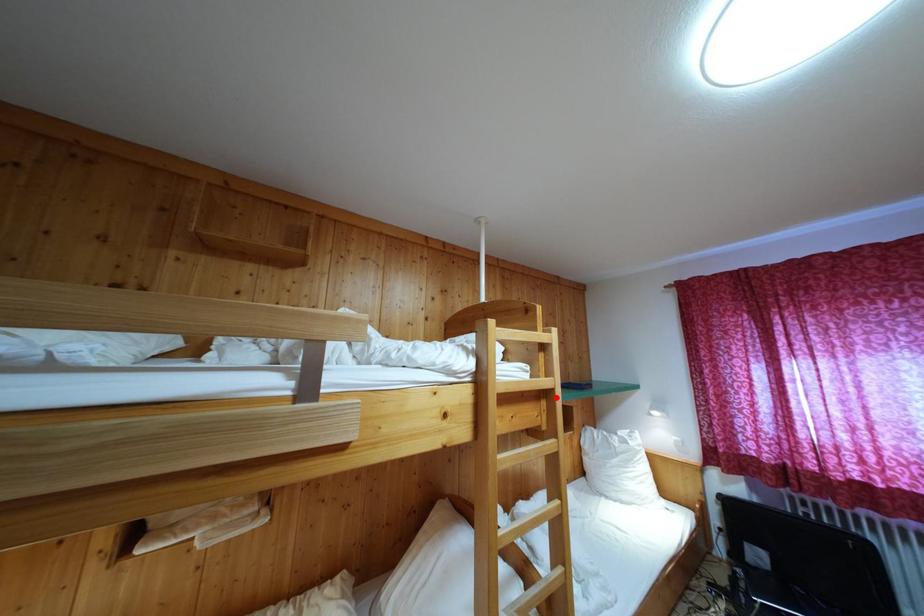
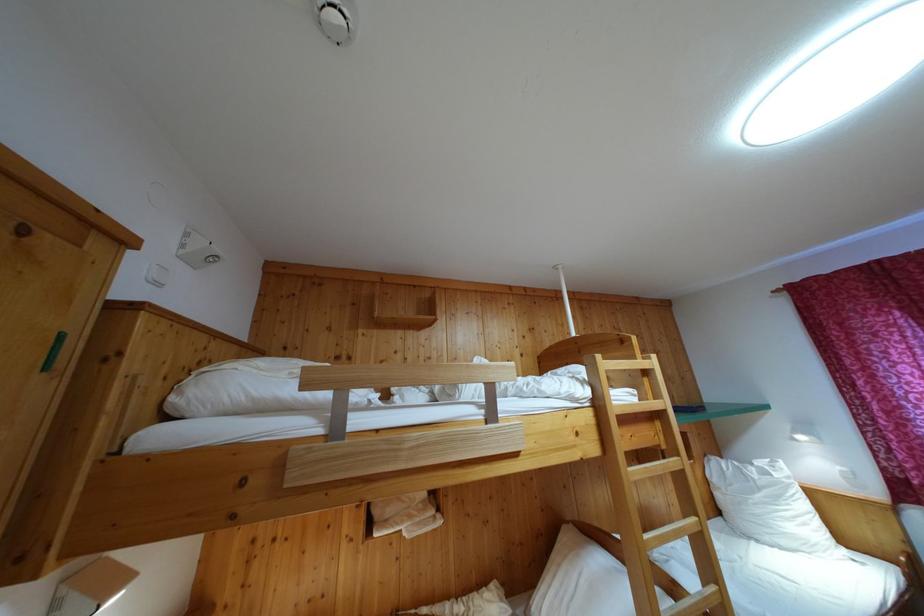
In the second image, find the point that corresponds to the highlighted location in the first image.

(669, 418)